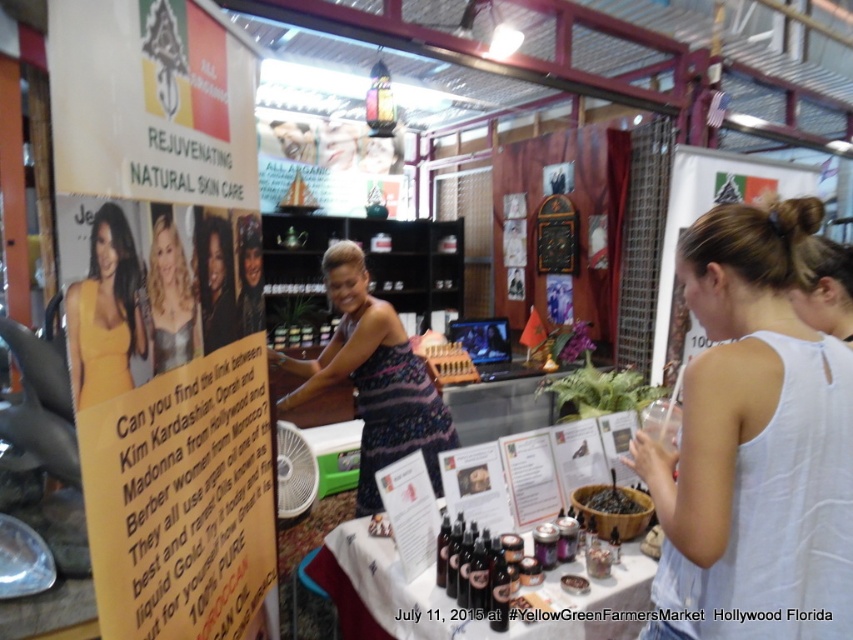
You are a photographer standing at the entrance of the market. You want to take a photo of the yellow satin dress at left without moving closer than 1 meter. Is the current distance sufficient?

The distance between the yellow satin dress at left and the camera is 80.58 centimeters, which is less than 1 meter. Therefore, the photographer can take the photo without needing to move closer than 1 meter.

You are a fashion buyer at a boutique store and you need to decide which dress to order more of based on their sizes. The striped fabric dress at center and the yellow satin dress at left are both in your catalog. Which dress has a larger size?

The striped fabric dress at center is bigger than the yellow satin dress at left, so you should order more of the striped fabric dress at center since it is larger in size.

You are a customer at the YellowGreen Farmers Market and want to touch both the signboard and the booth. The signboard is at point (165, 273) and the booth is at point (616, 497). Which one should you approach first to reach the closest one first?

You should approach the signboard at point (165, 273) first because it is closer to you than the booth at point (616, 497).